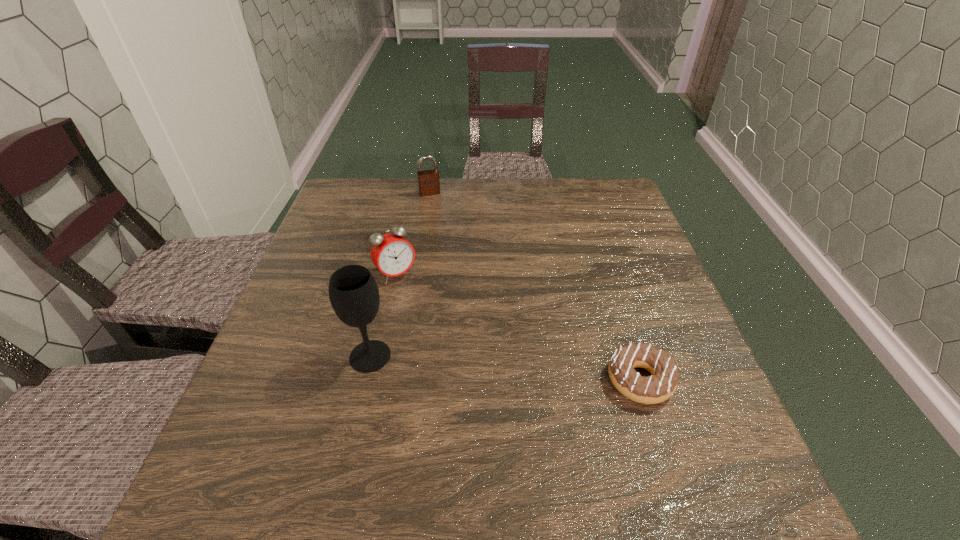
This screenshot has height=540, width=960. Identify the location of free spot located on the front-facing side of the padlock. (439, 214).

This screenshot has width=960, height=540. Find the location of `free space located 0.250m on the front-facing side of the padlock`. free space located 0.250m on the front-facing side of the padlock is located at coordinates (450, 245).

The height and width of the screenshot is (540, 960). What are the coordinates of `free space located on the front-facing side of the padlock` in the screenshot? It's located at (442, 222).

The image size is (960, 540). In order to click on object located in the far edge section of the desktop in this screenshot , I will do `click(428, 180)`.

Identify the location of object present at the near edge. (657, 388).

Identify the location of object situated at the right edge. Image resolution: width=960 pixels, height=540 pixels. (657, 388).

Locate an element on the screen. The width and height of the screenshot is (960, 540). object that is at the near right corner is located at coordinates (657, 388).

This screenshot has height=540, width=960. In the image, there is a desktop. In order to click on vacant space at the far edge in this screenshot , I will do `click(402, 183)`.

Find the location of a particular element. This screenshot has width=960, height=540. vacant space at the near edge of the desktop is located at coordinates (440, 409).

Locate an element on the screen. Image resolution: width=960 pixels, height=540 pixels. blank space at the left edge of the desktop is located at coordinates (x=267, y=396).